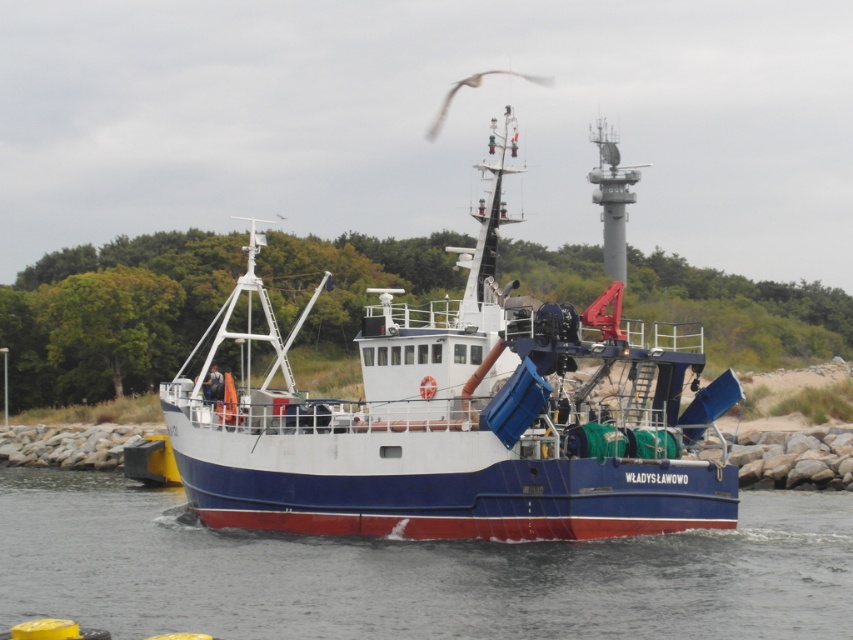
Question: Which object is the closest to the blue matte boat at center?

Choices:
 (A) blue smooth water at center
 (B) white feathered bird at upper center

Answer: (A)

Question: Can you confirm if blue matte boat at center is positioned to the left of blue smooth water at center?

Choices:
 (A) no
 (B) yes

Answer: (B)

Question: Can you confirm if blue smooth water at center is positioned below white feathered bird at upper center?

Choices:
 (A) yes
 (B) no

Answer: (A)

Question: Among these points, which one is farthest from the camera?

Choices:
 (A) (438, 122)
 (B) (764, 499)
 (C) (463, 308)

Answer: (A)

Question: Which is farther from the white feathered bird at upper center?

Choices:
 (A) blue smooth water at center
 (B) blue matte boat at center

Answer: (A)

Question: Can you confirm if blue matte boat at center is positioned to the right of white feathered bird at upper center?

Choices:
 (A) yes
 (B) no

Answer: (B)